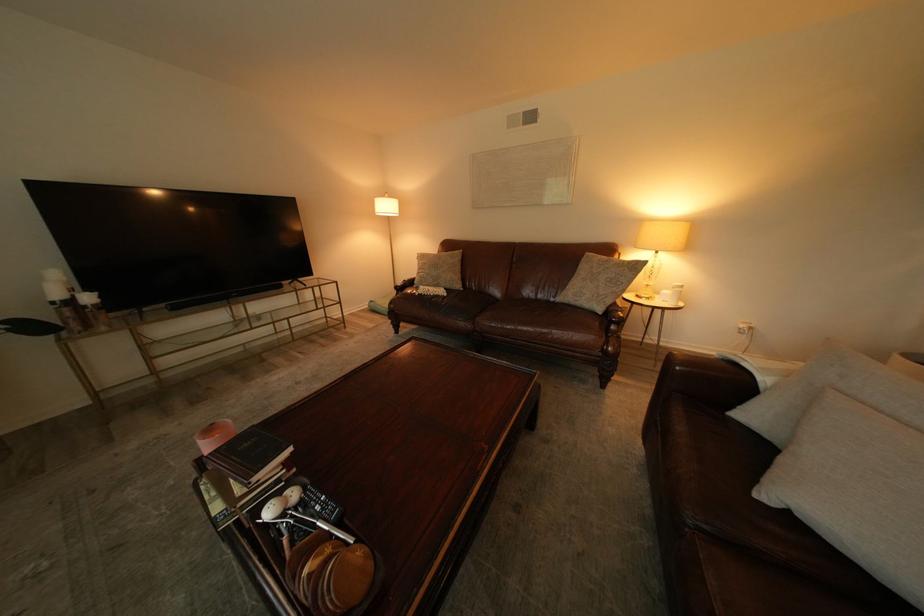
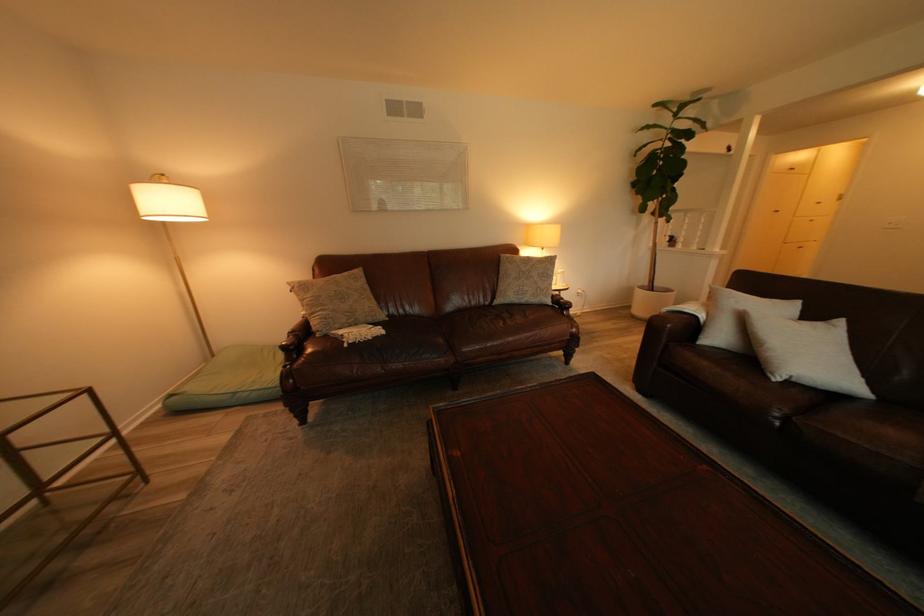
Locate, in the second image, the point that corresponds to [439,294] in the first image.

(372, 342)